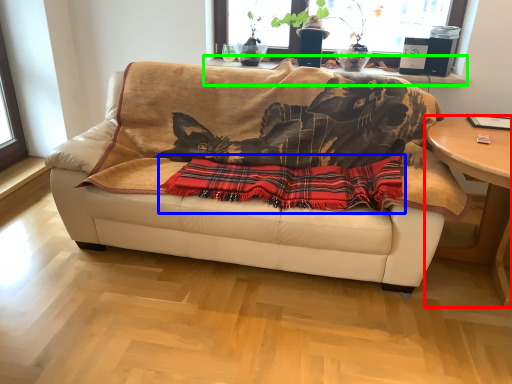
Question: Which object is the farthest from table (highlighted by a red box)? Choose among these: plaid (highlighted by a blue box) or window sill (highlighted by a green box).

Choices:
 (A) plaid
 (B) window sill

Answer: (B)